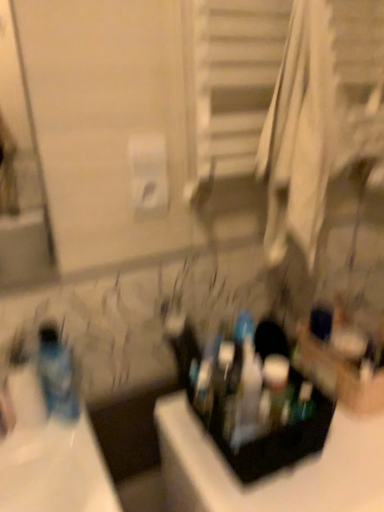
Question: From the image's perspective, is translucent plastic mouthwash at center positioned above or below black plastic container at center?

Choices:
 (A) above
 (B) below

Answer: (A)

Question: From a real-world perspective, is translucent plastic mouthwash at center above or below black plastic container at center?

Choices:
 (A) above
 (B) below

Answer: (A)

Question: Which object is the closest to the white matte toilet paper at upper center?

Choices:
 (A) translucent plastic bottle at left
 (B) translucent plastic mouthwash at center
 (C) black plastic container at center
 (D) translucent plastic toothbrush at center

Answer: (A)

Question: Considering the real-world distances, which object is farthest from the black plastic container at center?

Choices:
 (A) translucent plastic toothbrush at center
 (B) translucent plastic mouthwash at center
 (C) translucent plastic bottle at left
 (D) white matte toilet paper at upper center

Answer: (D)